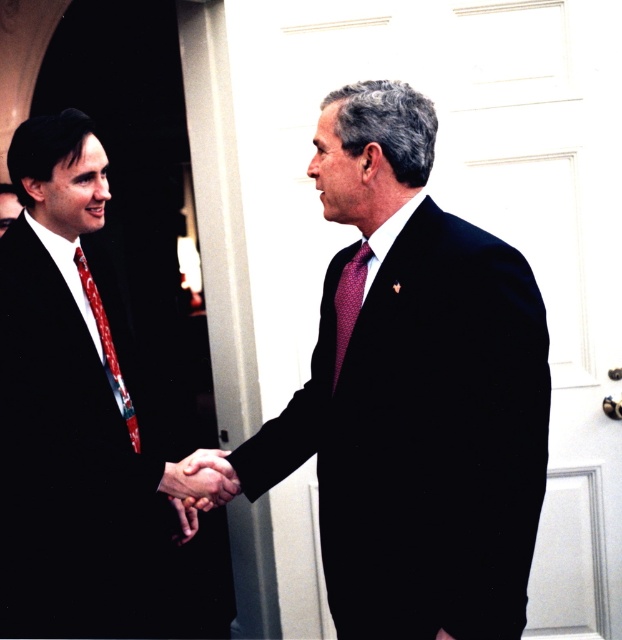
Describe the element at coordinates (415, 394) in the screenshot. This screenshot has height=640, width=622. I see `matte black suit at center` at that location.

Does matte black suit at center come behind red-patterned tie at left?

No, matte black suit at center is closer to the viewer.

Which is behind, point (417, 115) or point (98, 321)?

The point (98, 321) is more distant.

Image resolution: width=622 pixels, height=640 pixels. Identify the location of matte black suit at center. pos(415,394).

Which of these two, matte black suit at center or maroon textured tie at center, stands taller?

Standing taller between the two is matte black suit at center.

Who is higher up, matte black suit at center or maroon textured tie at center?

maroon textured tie at center

Identify the location of matte black suit at center. (415, 394).

Find the location of a particular element. The width and height of the screenshot is (622, 640). matte black suit at left is located at coordinates (75, 413).

Does matte black suit at left appear over maroon textured tie at center?

No.

The height and width of the screenshot is (640, 622). Find the location of `matte black suit at left`. matte black suit at left is located at coordinates (75, 413).